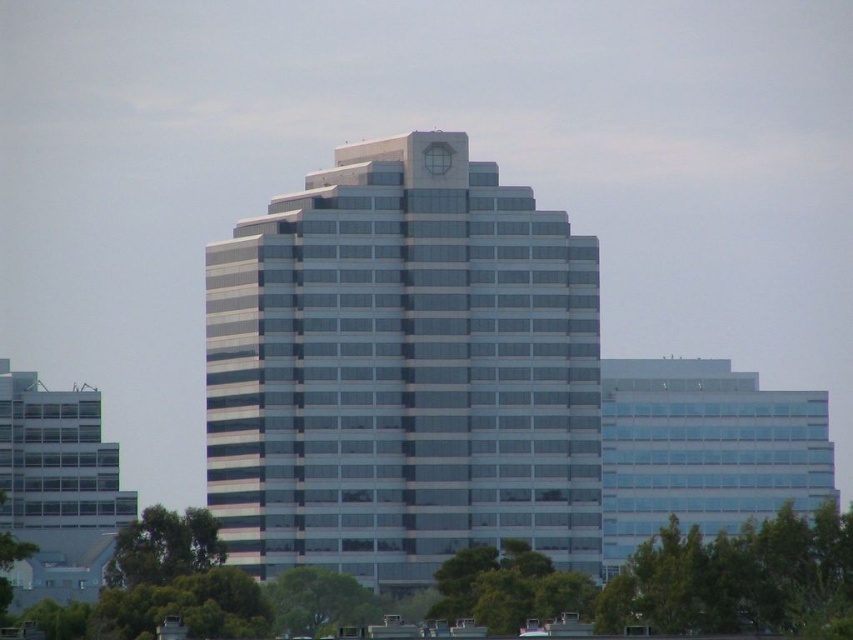
You are an architect evaluating the urban landscape. You notice the matte glass building at left and the green leafy tree at lower center. Which object is taller in the scene?

The matte glass building at left is taller than the green leafy tree at lower center.

You are an urban planner reviewing a cityscape design. The scene includes a glassy reflective building at center and a green leafy tree at lower center. Which object occupies more space in the image?

The glassy reflective building at center is bigger than the green leafy tree at lower center, so it occupies more space in the image.

You are standing at the entrance of the office complex and want to locate the glassy reflective building at center. According to the coordinates provided, where should you look to find it?

The glassy reflective building at center is located at coordinates point (402, 371).